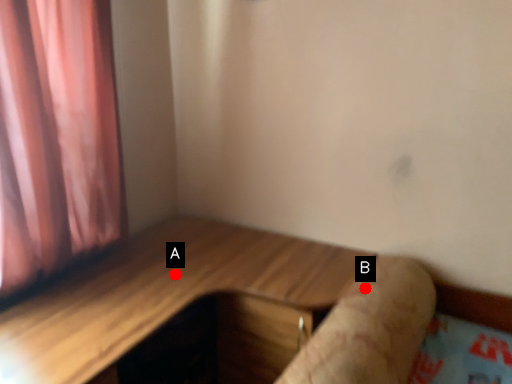
Question: Two points are circled on the image, labeled by A and B beside each circle. Which point appears farthest from the camera in this image?

Choices:
 (A) A is further
 (B) B is further

Answer: (A)